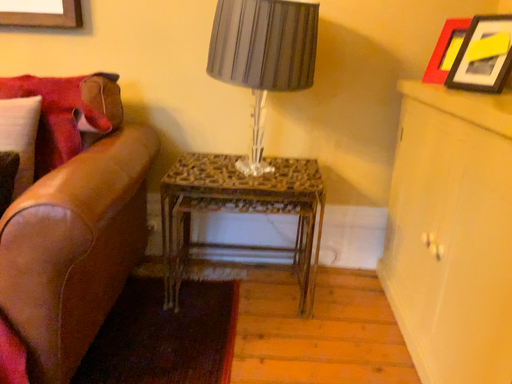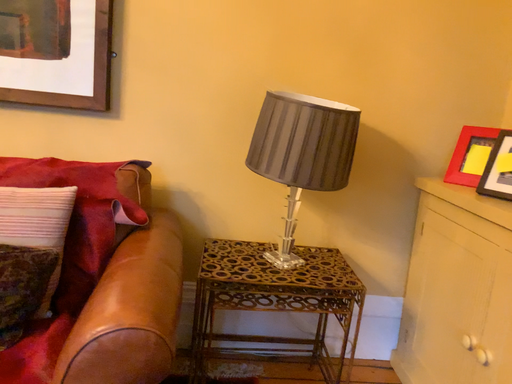
Question: How did the camera likely rotate when shooting the video?

Choices:
 (A) rotated right
 (B) rotated left

Answer: (A)